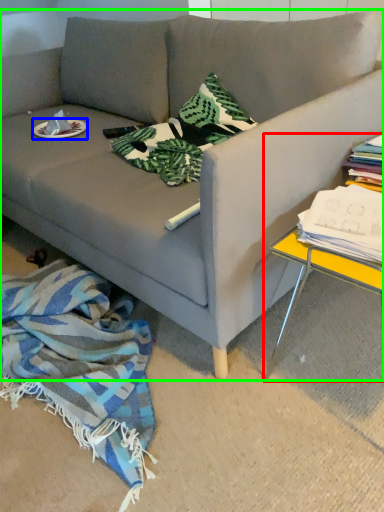
Question: Based on their relative distances, which object is nearer to table (highlighted by a red box)? Choose from plate (highlighted by a blue box) and studio couch (highlighted by a green box).

Choices:
 (A) plate
 (B) studio couch

Answer: (B)